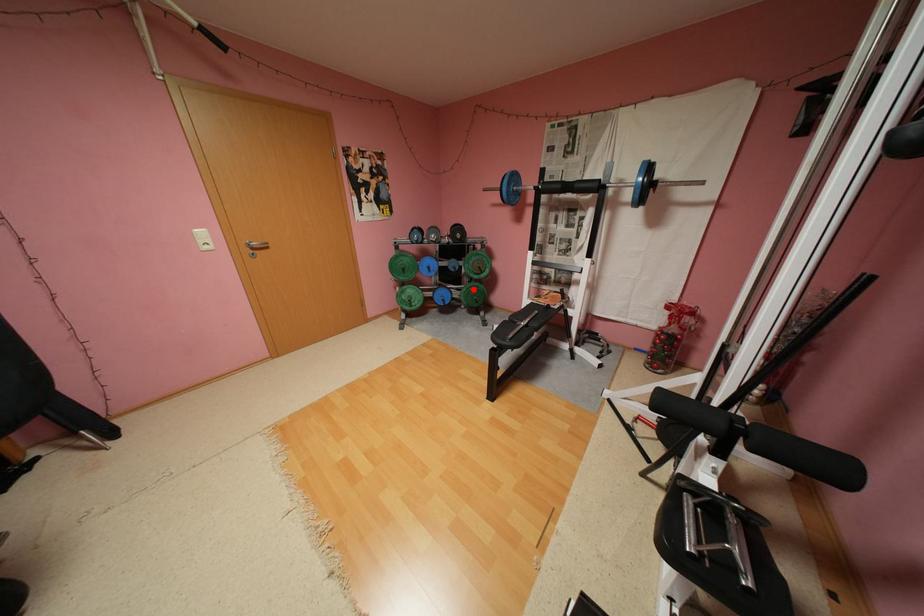
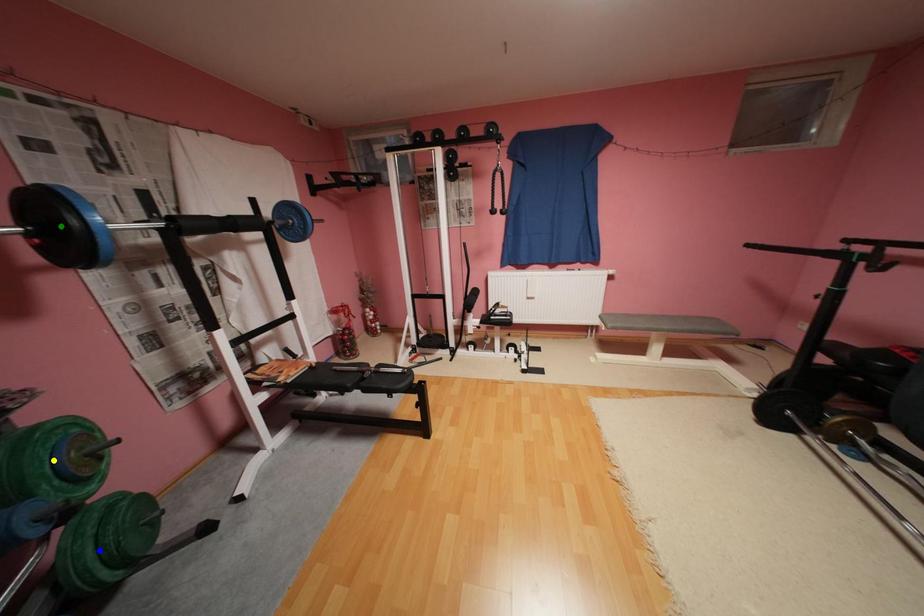
Question: I am providing you with two images of the same scene from different viewpoints. A red point is marked on the first image. You are given multiple points on the second image. Can you choose the point in image 2 that corresponds to the point in image 1?

Choices:
 (A) green point
 (B) blue point
 (C) yellow point

Answer: (B)